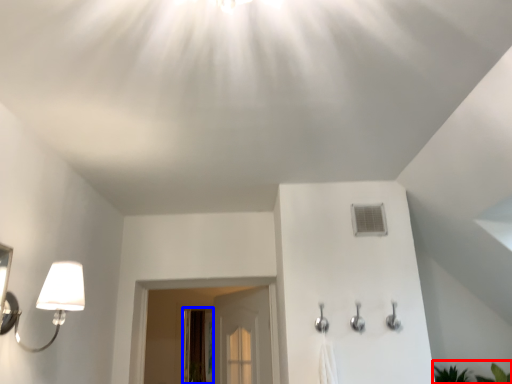
Question: Which of the following is the farthest to the observer, plant (highlighted by a red box) or screen door (highlighted by a blue box)?

Choices:
 (A) plant
 (B) screen door

Answer: (B)